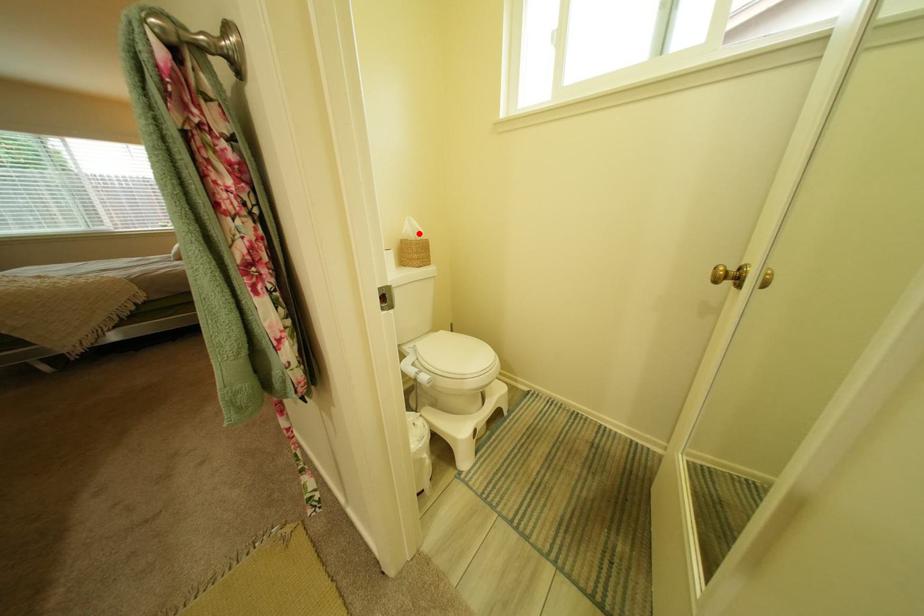
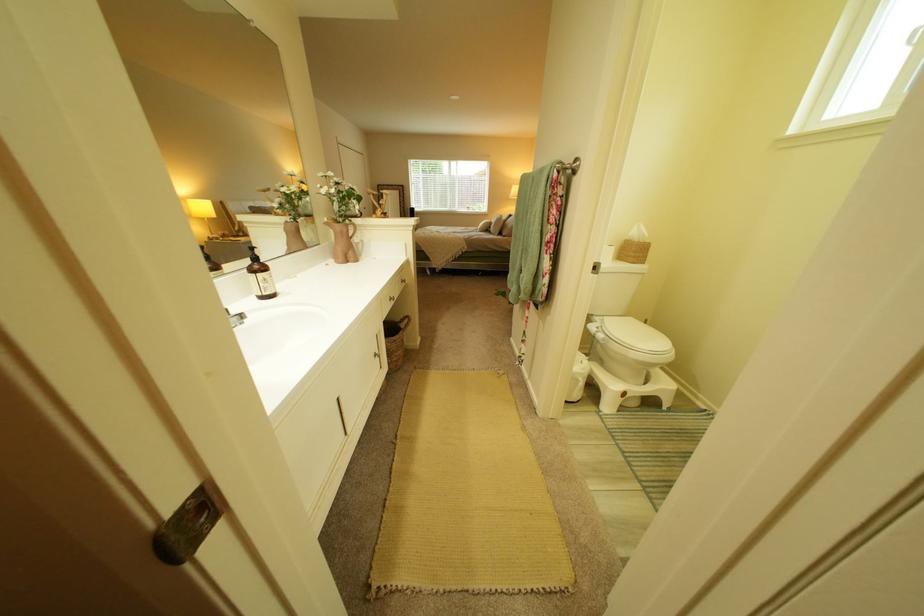
Locate, in the second image, the point that corresponds to the highlighted location in the first image.

(646, 236)